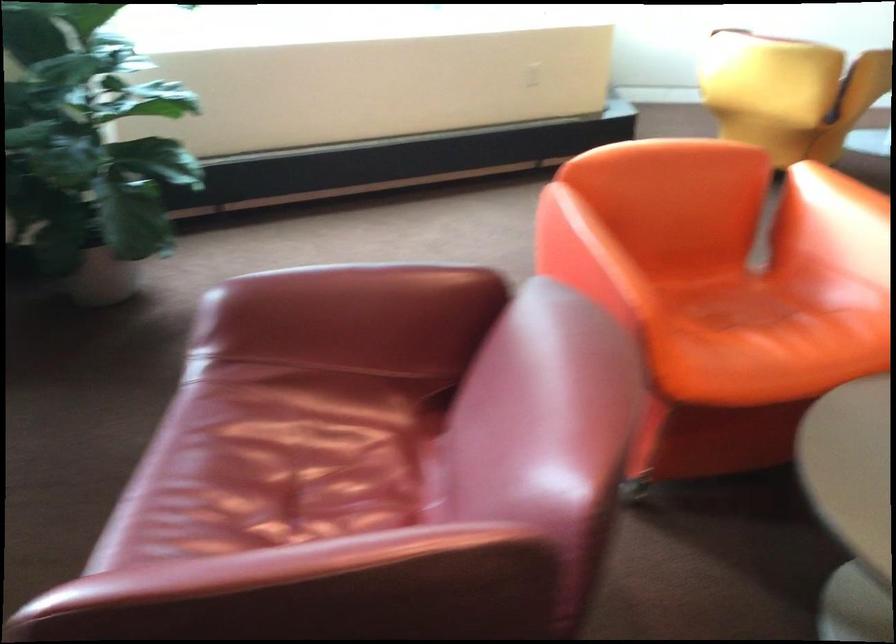
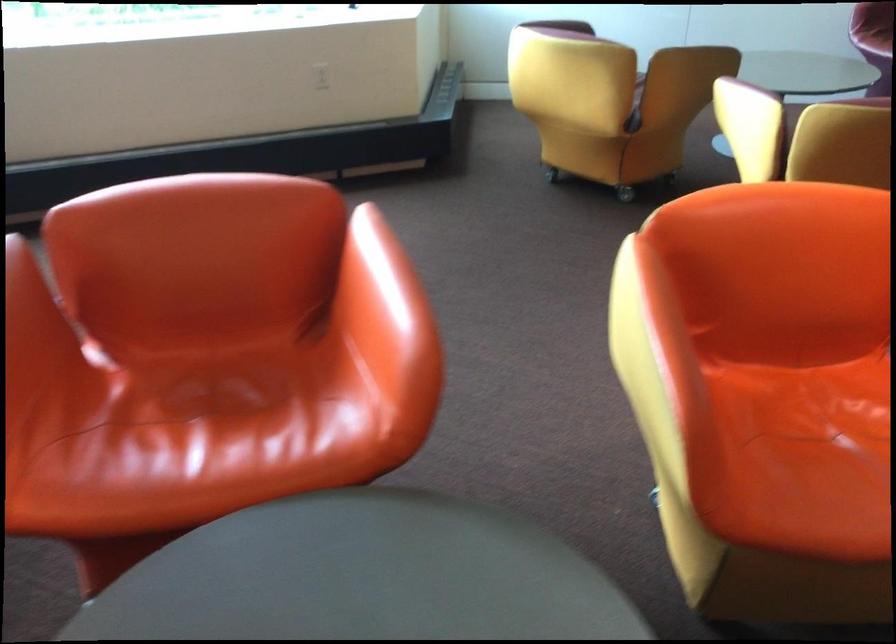
Question: The images are taken continuously from a first-person perspective. In which direction are you moving?

Choices:
 (A) Left
 (B) Right
 (C) Forward
 (D) Backward

Answer: (B)